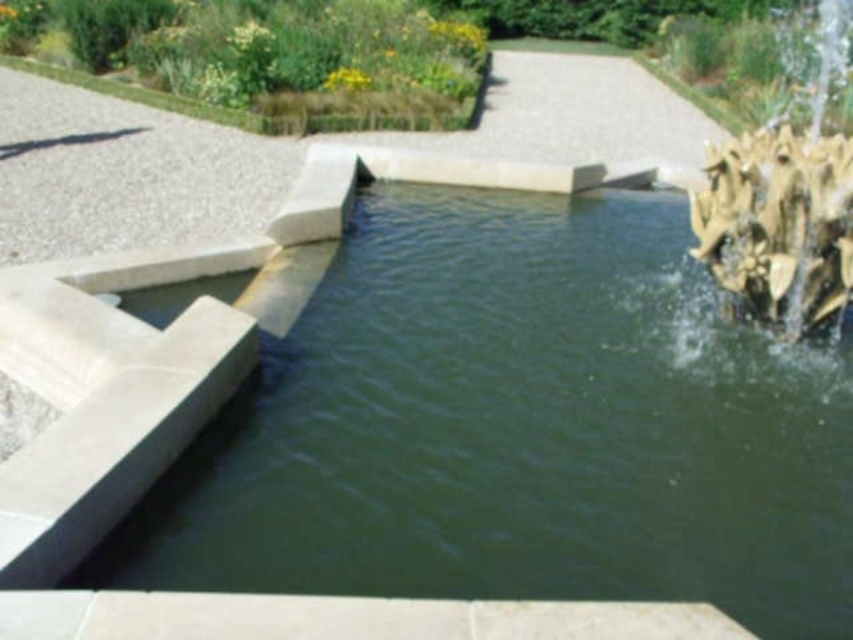
You are standing at the entrance of the garden and want to locate the green stone pool at center. According to the coordinates provided, in which direction should you move relative to your current position?

The green stone pool at center is located at coordinates point (517, 428). Since the coordinate system typically places the origin at the bottom left corner, a higher x value means moving to the right and a higher y value means moving upwards. Therefore, you should move to the right and upwards from your current position to reach the green stone pool at center.

You are standing in the garden and want to know which object is closer to the ground. According to the scene, which one is lower in height between the green stone pool at center and the green grass at upper left?

The green stone pool at center is shorter than the green grass at upper left, so the green stone pool at center is lower in height.